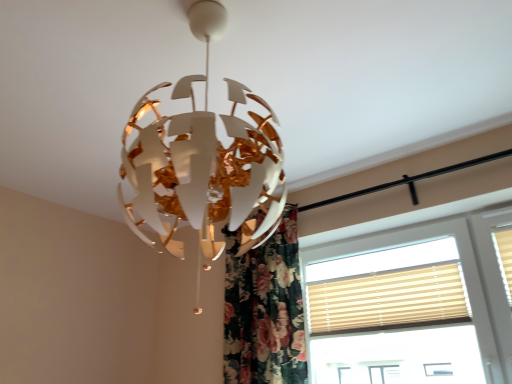
Question: Is floral fabric curtain at center bigger or smaller than beige fabric blinds at right?

Choices:
 (A) big
 (B) small

Answer: (A)

Question: Which is correct: floral fabric curtain at center is inside beige fabric blinds at right, or outside of it?

Choices:
 (A) outside
 (B) inside

Answer: (A)

Question: Which object is the closest to the beige fabric blinds at right?

Choices:
 (A) beige fabric window at right
 (B) floral fabric curtain at center

Answer: (A)

Question: Estimate the real-world distances between objects in this image. Which object is closer to the floral fabric curtain at center?

Choices:
 (A) beige fabric window at right
 (B) beige fabric blinds at right

Answer: (B)